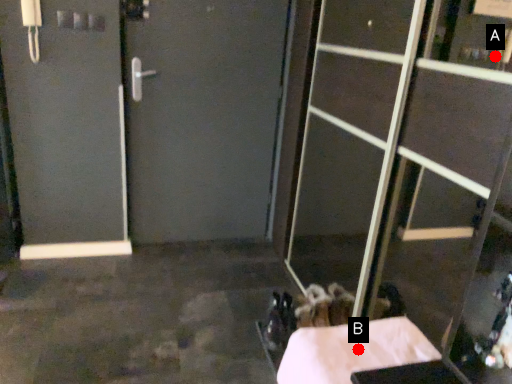
Question: Two points are circled on the image, labeled by A and B beside each circle. Which point is closer to the camera?

Choices:
 (A) A is closer
 (B) B is closer

Answer: (B)